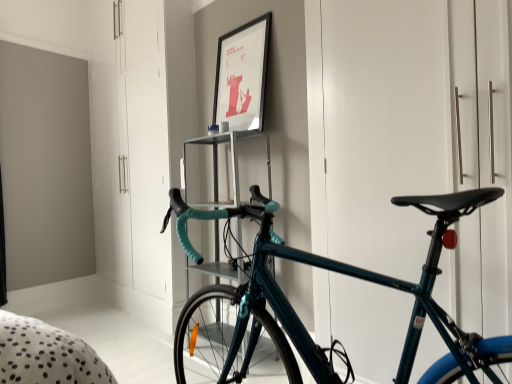
Question: From the image's perspective, is metallic silver shelf at center under teal glossy bicycle at right?

Choices:
 (A) no
 (B) yes

Answer: (B)

Question: Can you confirm if metallic silver shelf at center is smaller than teal glossy bicycle at right?

Choices:
 (A) yes
 (B) no

Answer: (A)

Question: Considering the relative positions of metallic silver shelf at center and teal glossy bicycle at right in the image provided, is metallic silver shelf at center in front of teal glossy bicycle at right?

Choices:
 (A) no
 (B) yes

Answer: (A)

Question: Is teal glossy bicycle at right at the back of metallic silver shelf at center?

Choices:
 (A) yes
 (B) no

Answer: (B)

Question: Can you confirm if metallic silver shelf at center is taller than teal glossy bicycle at right?

Choices:
 (A) yes
 (B) no

Answer: (B)

Question: Considering their positions, is metallic silver shelf at center located in front of or behind teal glossy bicycle at center?

Choices:
 (A) front
 (B) behind

Answer: (B)

Question: In terms of height, does metallic silver shelf at center look taller or shorter compared to teal glossy bicycle at center?

Choices:
 (A) short
 (B) tall

Answer: (B)

Question: Is metallic silver shelf at center to the left or to the right of teal glossy bicycle at center in the image?

Choices:
 (A) left
 (B) right

Answer: (A)

Question: Looking at their shapes, would you say metallic silver shelf at center is wider or thinner than teal glossy bicycle at center?

Choices:
 (A) thin
 (B) wide

Answer: (A)

Question: Considering their positions, is metallic silver shelf at center located in front of or behind white glossy dresser at center?

Choices:
 (A) front
 (B) behind

Answer: (A)

Question: From a real-world perspective, is metallic silver shelf at center positioned above or below white glossy dresser at center?

Choices:
 (A) below
 (B) above

Answer: (A)

Question: Does point (223, 261) appear closer or farther from the camera than point (136, 69)?

Choices:
 (A) farther
 (B) closer

Answer: (B)

Question: Looking at their shapes, would you say metallic silver shelf at center is wider or thinner than white glossy dresser at center?

Choices:
 (A) thin
 (B) wide

Answer: (B)

Question: From the image's perspective, is teal glossy bicycle at center located above or below matte black picture frame at upper center?

Choices:
 (A) below
 (B) above

Answer: (A)

Question: Is point (287, 306) positioned closer to the camera than point (252, 99)?

Choices:
 (A) closer
 (B) farther

Answer: (A)